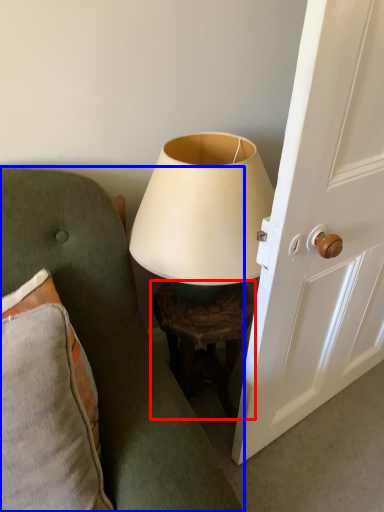
Question: Which point is closer to the camera, table (highlighted by a red box) or furniture (highlighted by a blue box)?

Choices:
 (A) table
 (B) furniture

Answer: (B)